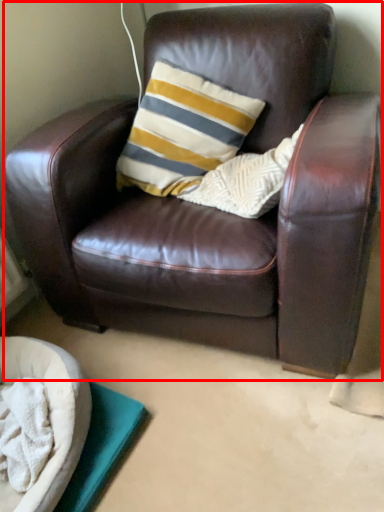
Question: In this image, where is chair (annotated by the red box) located relative to dog bed?

Choices:
 (A) right
 (B) left

Answer: (A)